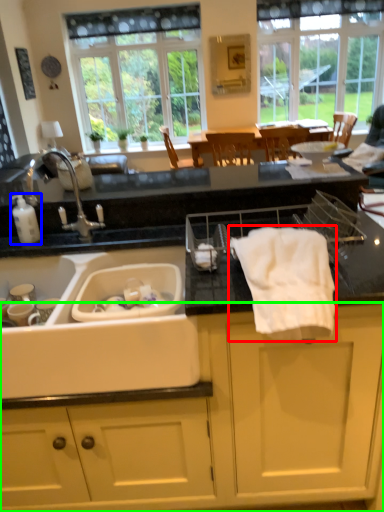
Question: Which object is positioned closest to bath towel (highlighted by a red box)? Select from toiletry (highlighted by a blue box) and cabinetry (highlighted by a green box).

Choices:
 (A) toiletry
 (B) cabinetry

Answer: (B)